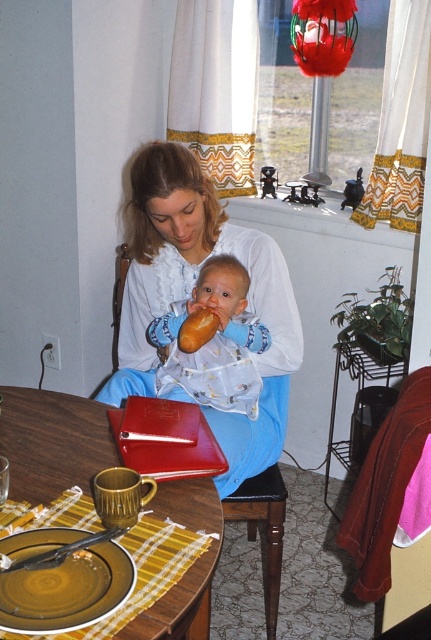
Based on the photo, you are a photographer trying to capture a closeup of the baby holding bread. The baby is between the matte white blouse at center and the soft blue fabric at center. Which object should you move to get a better view of the baby?

The soft blue fabric at center is behind the matte white blouse at center, so you should move the matte white blouse at center to get a better view of the baby.

You are a guest at this dining table and want to place your napkin on the yellow fabric placemat at lower left. However, you notice the matte brown bread at center is in the way. Can you easily move the bread to access the placemat?

The yellow fabric placemat at lower left is below the matte brown bread at center, so the bread is blocking access to the placemat. You would need to move the bread to reach the placemat.

You are a photographer standing 1.5 meters away from the baby. You want to take a photo of the matte white blouse at center. Can you reach the blouse within your current position without moving closer?

The distance between you and the matte white blouse at center is 1.61 meters. Since you are only 1.5 meters away, you are already close enough to reach the blouse without moving closer.